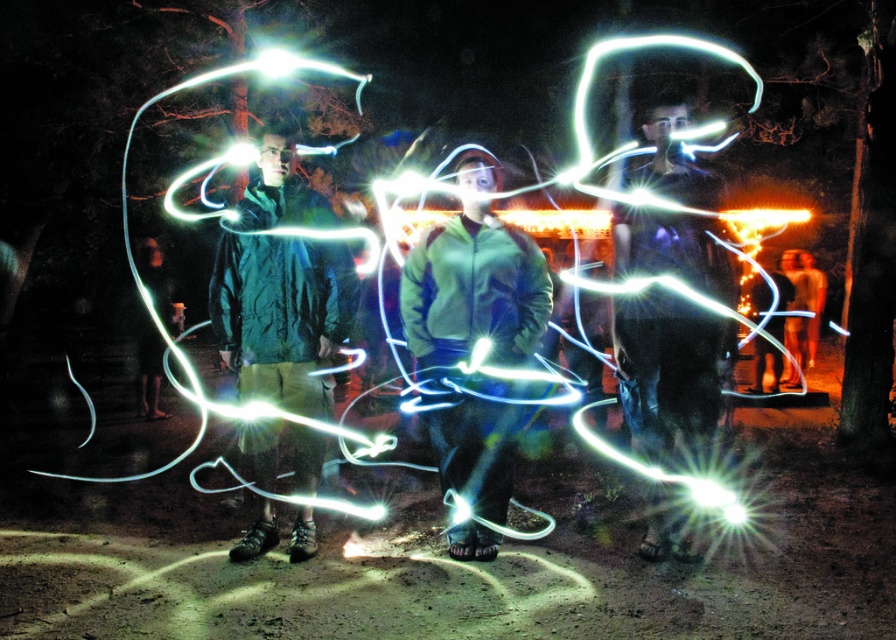
Question: Is green matte jacket at center above matte black jacket at center?

Choices:
 (A) yes
 (B) no

Answer: (B)

Question: Can you confirm if green matte jacket at center is thinner than matte black jacket at center?

Choices:
 (A) no
 (B) yes

Answer: (A)

Question: Based on their relative distances, which object is farther from the matte black jacket at center?

Choices:
 (A) green matte jacket at center
 (B) green fleece jacket at center

Answer: (A)

Question: Which object is the closest to the green matte jacket at center?

Choices:
 (A) matte black jacket at center
 (B) green fleece jacket at center

Answer: (B)

Question: Which object is positioned farthest from the green fleece jacket at center?

Choices:
 (A) matte black jacket at center
 (B) green matte jacket at center

Answer: (B)

Question: In this image, where is green matte jacket at center located relative to matte black jacket at center?

Choices:
 (A) below
 (B) above

Answer: (A)